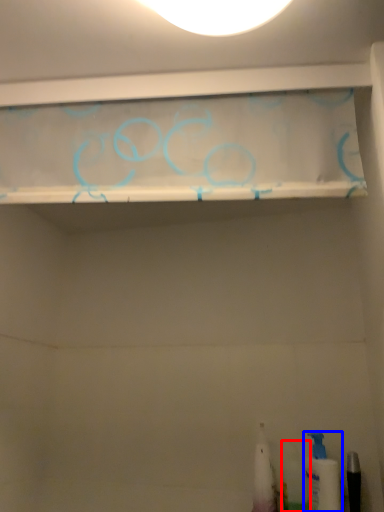
Question: Which object is closer to the camera taking this photo, toiletry (highlighted by a red box) or toiletry (highlighted by a blue box)?

Choices:
 (A) toiletry
 (B) toiletry

Answer: (B)